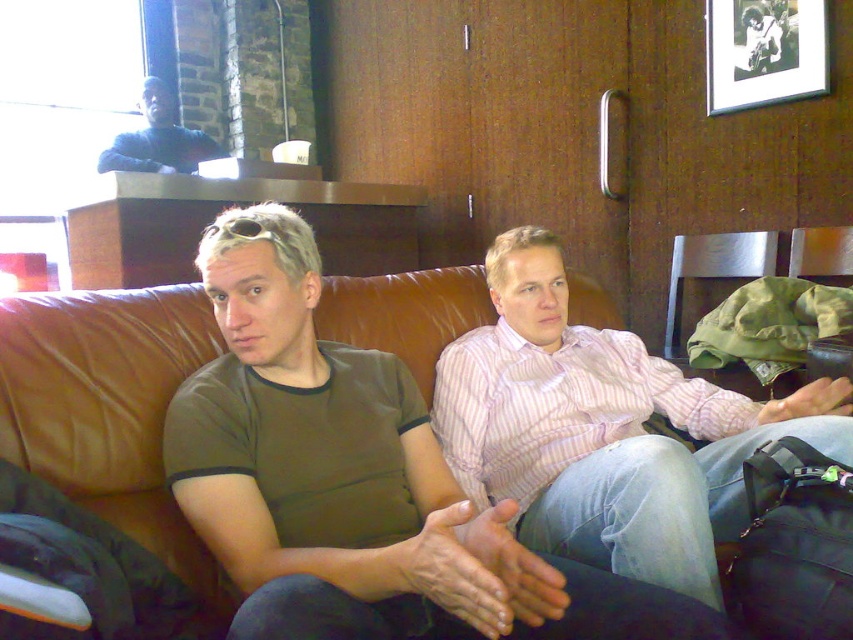
Question: Which object is the closest to the brown leather couch at center?

Choices:
 (A) pink striped shirt at center
 (B) dark blue sweater at upper left
 (C) black matte picture frame at upper right

Answer: (A)

Question: Which object appears closest to the camera in this image?

Choices:
 (A) black matte picture frame at upper right
 (B) dark blue sweater at upper left
 (C) pink striped shirt at center
 (D) brown leather couch at center

Answer: (C)

Question: Which object is the farthest from the black matte picture frame at upper right?

Choices:
 (A) pink striped shirt at center
 (B) brown leather couch at center
 (C) dark blue sweater at upper left

Answer: (C)

Question: Can you confirm if pink striped shirt at center is smaller than brown leather couch at center?

Choices:
 (A) yes
 (B) no

Answer: (A)

Question: From the image, what is the correct spatial relationship of pink striped shirt at center in relation to dark blue sweater at upper left?

Choices:
 (A) above
 (B) below

Answer: (B)

Question: Is brown leather couch at center below black matte picture frame at upper right?

Choices:
 (A) no
 (B) yes

Answer: (B)